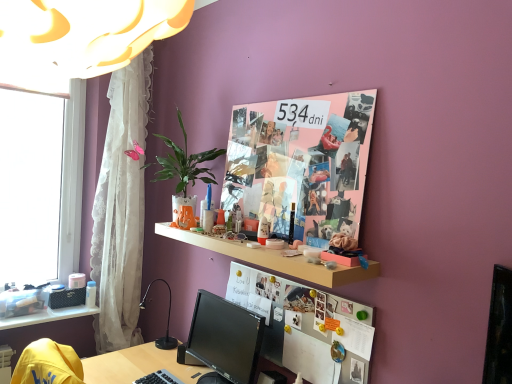
Measure the distance between point (184, 180) and camera.

Point (184, 180) is 2.07 meters from camera.

Identify the location of whiteboard at center. This screenshot has width=512, height=384. (304, 326).

Locate an element on the screen. This screenshot has height=384, width=512. black plastic keyboard at lower center is located at coordinates (159, 378).

Locate an element on the screen. smooth skin face at upper center is located at coordinates (269, 133).

Locate an element on the screen. white plastic window at left is located at coordinates (30, 185).

Measure the distance between clear plastic storage at lower left, acting as the 2th shelf starting from the right, and camera.

A distance of 6.73 feet exists between clear plastic storage at lower left, acting as the 2th shelf starting from the right, and camera.

What is the approximate height of clear plastic storage at lower left, the first shelf from the bottom?

The height of clear plastic storage at lower left, the first shelf from the bottom, is 1.16 inches.

At what (x,y) coordinates should I click in order to perform the action: click on black glossy monitor at center. Please return your answer as a coordinate pair (x, y). The width and height of the screenshot is (512, 384). Looking at the image, I should click on (226, 337).

Does black plastic keyboard at lower center turn towards pink plastic houseplant at upper center?

No, black plastic keyboard at lower center does not turn towards pink plastic houseplant at upper center.

Considering the relative sizes of black plastic keyboard at lower center and pink plastic houseplant at upper center in the image provided, is black plastic keyboard at lower center bigger than pink plastic houseplant at upper center?

No, black plastic keyboard at lower center is not bigger than pink plastic houseplant at upper center.

Considering the relative sizes of black plastic keyboard at lower center and pink plastic houseplant at upper center in the image provided, is black plastic keyboard at lower center wider than pink plastic houseplant at upper center?

Incorrect, the width of black plastic keyboard at lower center does not surpass that of pink plastic houseplant at upper center.

Is pink plastic houseplant at upper center smaller than white lace curtain at left?

Yes.

From the image's perspective, which one is positioned higher, pink plastic houseplant at upper center or white lace curtain at left?

pink plastic houseplant at upper center.

Measure the distance between pink plastic houseplant at upper center and white lace curtain at left.

pink plastic houseplant at upper center and white lace curtain at left are 50.71 centimeters apart from each other.

Between pink plastic houseplant at upper center and white lace curtain at left, which one appears on the right side from the viewer's perspective?

From the viewer's perspective, pink plastic houseplant at upper center appears more on the right side.

Looking at their sizes, would you say pink plastic houseplant at upper center is wider or thinner than black glossy monitor at center?

In the image, pink plastic houseplant at upper center appears to be wider than black glossy monitor at center.

Is point (208, 172) positioned in front of point (217, 369)?

No, (208, 172) is behind (217, 369).

Is pink plastic houseplant at upper center looking in the opposite direction of black glossy monitor at center?

pink plastic houseplant at upper center is not turned away from black glossy monitor at center.

From the image's perspective, is pink plastic houseplant at upper center below black glossy monitor at center?

Incorrect, from the image's perspective, pink plastic houseplant at upper center is higher than black glossy monitor at center.

From a real-world perspective, who is located higher, black glossy monitor at center or black plastic keyboard at lower center?

In real-world perspective, black glossy monitor at center is above.

From the picture: Is black glossy monitor at center wider or thinner than black plastic keyboard at lower center?

In the image, black glossy monitor at center appears to be wider than black plastic keyboard at lower center.

Can you tell me how much black glossy monitor at center and black plastic keyboard at lower center differ in facing direction?

black glossy monitor at center and black plastic keyboard at lower center are facing 0.0288 degrees away from each other.

Is black glossy monitor at center aimed at black plastic keyboard at lower center?

Yes, black glossy monitor at center is oriented towards black plastic keyboard at lower center.

Are pink plastic houseplant at upper center and smooth skin face at upper center far apart?

Actually, pink plastic houseplant at upper center and smooth skin face at upper center are a little close together.

In the scene shown: Is pink plastic houseplant at upper center inside the boundaries of smooth skin face at upper center, or outside?

pink plastic houseplant at upper center is located beyond the bounds of smooth skin face at upper center.

From the image's perspective, which is above, pink plastic houseplant at upper center or smooth skin face at upper center?

smooth skin face at upper center appears higher in the image.

Which of these two, pink plastic houseplant at upper center or smooth skin face at upper center, is bigger?

pink plastic houseplant at upper center.

In the scene shown: Which point is more distant from viewer, (159, 371) or (99, 234)?

Positioned behind is point (99, 234).

Is black plastic keyboard at lower center positioned far away from white lace curtain at left?

black plastic keyboard at lower center is actually quite close to white lace curtain at left.

Would you say white lace curtain at left is part of black plastic keyboard at lower center's contents?

Definitely not — white lace curtain at left is not inside black plastic keyboard at lower center.

Between white plastic window at left and whiteboard at center, which one has smaller size?

Smaller between the two is whiteboard at center.

Where is `window screen behind the whiteboard at center`? window screen behind the whiteboard at center is located at coordinates (30, 185).

Which object is thinner, white plastic window at left or whiteboard at center?

whiteboard at center is thinner.

Image resolution: width=512 pixels, height=384 pixels. I want to click on houseplant above the black plastic keyboard at lower center (from the image's perspective), so click(185, 163).

Where is `curtain on the left side of pink plastic houseplant at upper center`? The width and height of the screenshot is (512, 384). curtain on the left side of pink plastic houseplant at upper center is located at coordinates (121, 210).

Considering their positions, is pink paper collage at upper center positioned closer to whiteboard at center than black glossy monitor at center?

black glossy monitor at center is closer to whiteboard at center.

From the image, which object appears to be farther from white lace curtain at left, white plastic window at left or black glossy monitor at center?

Among the two, black glossy monitor at center is located further to white lace curtain at left.

From the picture: Considering their positions, is pink paper collage at upper center positioned further to white plastic window at left than wooden shelf at center, which is counted as the first shelf, starting from the front?

Based on the image, pink paper collage at upper center appears to be further to white plastic window at left.

Consider the image. Considering their positions, is pink paper collage at upper center positioned further to white lace curtain at left than white plastic window at left?

Based on the image, pink paper collage at upper center appears to be further to white lace curtain at left.

Consider the image. Estimate the real-world distances between objects in this image. Which object is further from wooden shelf at center, positioned as the 2th shelf in back-to-front order, black plastic keyboard at lower center or clear plastic storage at lower left, the first shelf from the bottom?

clear plastic storage at lower left, the first shelf from the bottom, is further to wooden shelf at center, positioned as the 2th shelf in back-to-front order.

Which object lies further to the anchor point black plastic keyboard at lower center, white plastic window at left or clear plastic storage at lower left, acting as the 2th shelf starting from the right?

The object further to black plastic keyboard at lower center is white plastic window at left.

From the image, which object appears to be farther from black plastic keyboard at lower center, wooden shelf at center, the 2th shelf positioned from the bottom, or black glossy monitor at center?

The object further to black plastic keyboard at lower center is wooden shelf at center, the 2th shelf positioned from the bottom.

When comparing their distances from black plastic keyboard at lower center, does white plastic window at left or wooden shelf at center, positioned as the 2th shelf in back-to-front order, seem closer?

wooden shelf at center, positioned as the 2th shelf in back-to-front order, is closer to black plastic keyboard at lower center.

At what (x,y) coordinates should I click in order to perform the action: click on keyboard between clear plastic storage at lower left, arranged as the 1th shelf when viewed from the left, and whiteboard at center, in the horizontal direction. Please return your answer as a coordinate pair (x, y). Looking at the image, I should click on (159, 378).

Identify the location of curtain between pink plastic houseplant at upper center and clear plastic storage at lower left, which is the first shelf in back-to-front order, vertically. This screenshot has width=512, height=384. (121, 210).

Identify the location of bulletin board that lies between pink paper collage at upper center and black glossy monitor at center from top to bottom. The height and width of the screenshot is (384, 512). (304, 326).

The width and height of the screenshot is (512, 384). Identify the location of curtain located between white plastic window at left and pink plastic houseplant at upper center in the left-right direction. (121, 210).